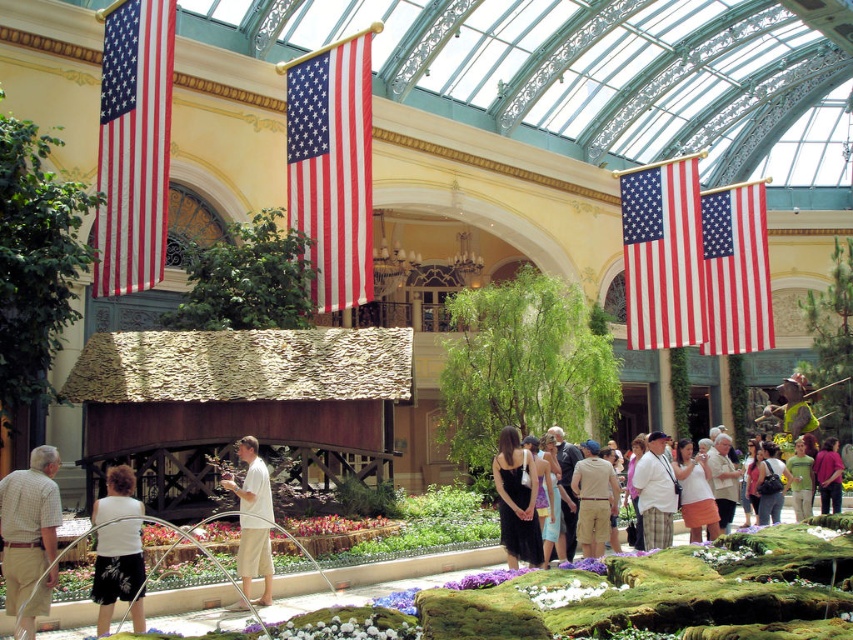
Is white floral fabric at lower left wider than white cotton shirt at center?

Correct, the width of white floral fabric at lower left exceeds that of white cotton shirt at center.

Between point (131, 588) and point (259, 467), which one is positioned in front?

Point (131, 588) is in front.

Where is `white floral fabric at lower left`? white floral fabric at lower left is located at coordinates (119, 573).

Which is behind, point (660, 253) or point (223, 260)?

Positioned behind is point (660, 253).

Looking at this image, between red/white striped flag at upper right and green leafy plant at center, which one appears on the right side from the viewer's perspective?

Positioned to the right is red/white striped flag at upper right.

Is point (622, 243) closer to viewer compared to point (241, 296)?

No, it is not.

Identify the location of red/white striped flag at upper right. (662, 253).

Does point (311, 250) lie in front of point (123, 488)?

No.

Where is `red/white striped flag at center`? red/white striped flag at center is located at coordinates (332, 164).